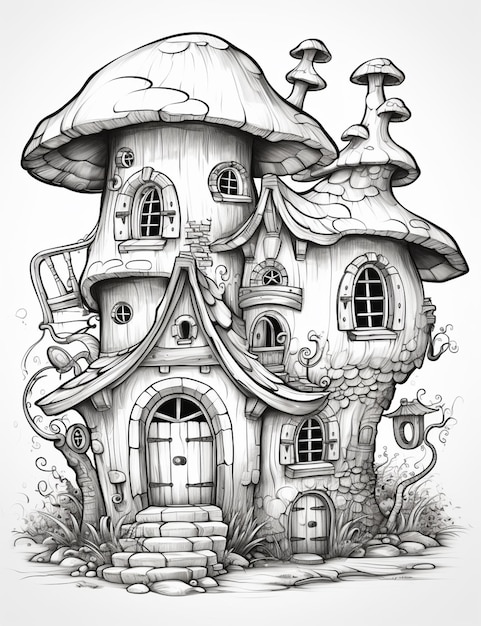
The height and width of the screenshot is (626, 481). Find the location of `main door`. main door is located at coordinates (185, 464).